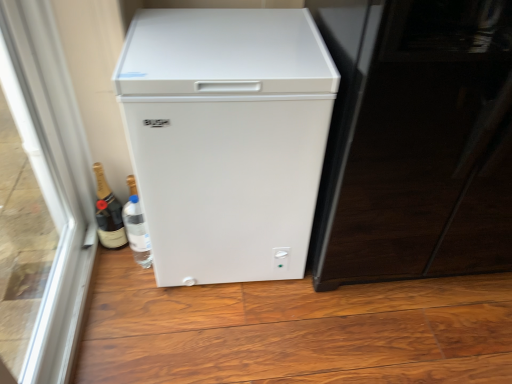
Question: Does transparent glass door at left have a greater width compared to white matte refrigerator at center?

Choices:
 (A) yes
 (B) no

Answer: (B)

Question: Is transparent glass door at left to the left of white matte refrigerator at center from the viewer's perspective?

Choices:
 (A) yes
 (B) no

Answer: (A)

Question: Considering the relative sizes of transparent glass door at left and white matte refrigerator at center in the image provided, is transparent glass door at left taller than white matte refrigerator at center?

Choices:
 (A) no
 (B) yes

Answer: (B)

Question: From the image's perspective, is transparent glass door at left on white matte refrigerator at center?

Choices:
 (A) yes
 (B) no

Answer: (B)

Question: Is transparent glass door at left in contact with white matte refrigerator at center?

Choices:
 (A) no
 (B) yes

Answer: (A)

Question: Is point (143, 79) positioned closer to the camera than point (101, 228)?

Choices:
 (A) farther
 (B) closer

Answer: (B)

Question: Based on their sizes in the image, would you say white matte refrigerator at center is bigger or smaller than matte gold champagne bottle at lower left?

Choices:
 (A) big
 (B) small

Answer: (A)

Question: From the image's perspective, is white matte refrigerator at center located above or below matte gold champagne bottle at lower left?

Choices:
 (A) below
 (B) above

Answer: (B)

Question: Is white matte refrigerator at center in front of or behind matte gold champagne bottle at lower left in the image?

Choices:
 (A) behind
 (B) front

Answer: (B)

Question: Based on their sizes in the image, would you say white matte refrigerator at center is bigger or smaller than glossy black screen door at right?

Choices:
 (A) big
 (B) small

Answer: (B)

Question: Looking at their shapes, would you say white matte refrigerator at center is wider or thinner than glossy black screen door at right?

Choices:
 (A) thin
 (B) wide

Answer: (A)

Question: From the image's perspective, is white matte refrigerator at center above or below glossy black screen door at right?

Choices:
 (A) above
 (B) below

Answer: (B)

Question: Is point (226, 153) positioned closer to the camera than point (454, 266)?

Choices:
 (A) closer
 (B) farther

Answer: (A)

Question: In terms of width, does glossy black screen door at right look wider or thinner when compared to white matte refrigerator at center?

Choices:
 (A) wide
 (B) thin

Answer: (A)

Question: Is glossy black screen door at right in front of or behind white matte refrigerator at center in the image?

Choices:
 (A) front
 (B) behind

Answer: (A)